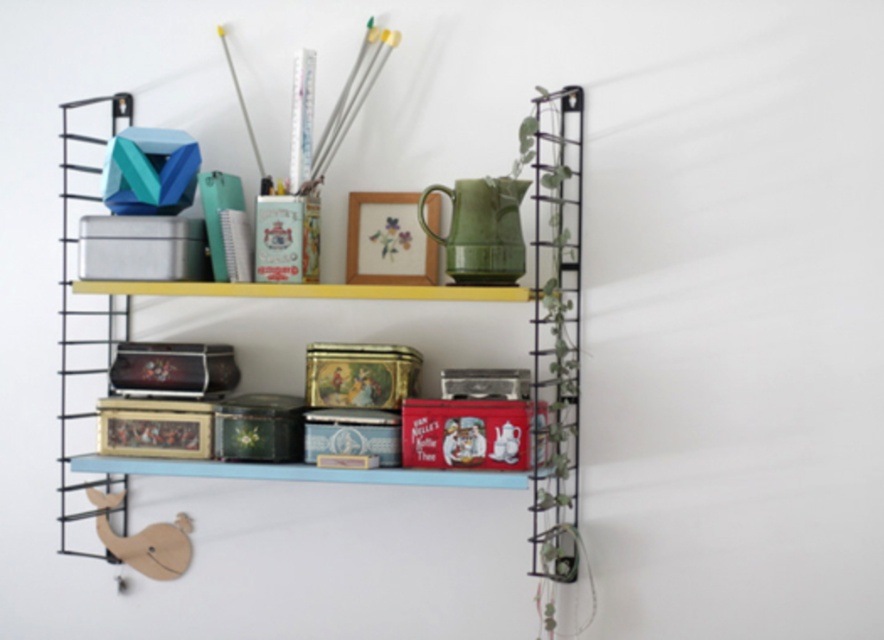
Question: Which point is farther to the camera?

Choices:
 (A) (406, 477)
 (B) (555, 412)

Answer: (B)

Question: Can you confirm if metallic tin at upper center is positioned above metallic tin cans at center?

Choices:
 (A) no
 (B) yes

Answer: (B)

Question: Does metallic tin at upper center appear under metallic tin cans at center?

Choices:
 (A) yes
 (B) no

Answer: (B)

Question: Where is metallic tin at upper center located in relation to metallic tin cans at center in the image?

Choices:
 (A) left
 (B) right

Answer: (B)

Question: Among these points, which one is farthest from the camera?

Choices:
 (A) (569, 324)
 (B) (216, 294)

Answer: (A)

Question: Which of the following is the closest to the observer?

Choices:
 (A) (555, 212)
 (B) (166, 284)

Answer: (B)